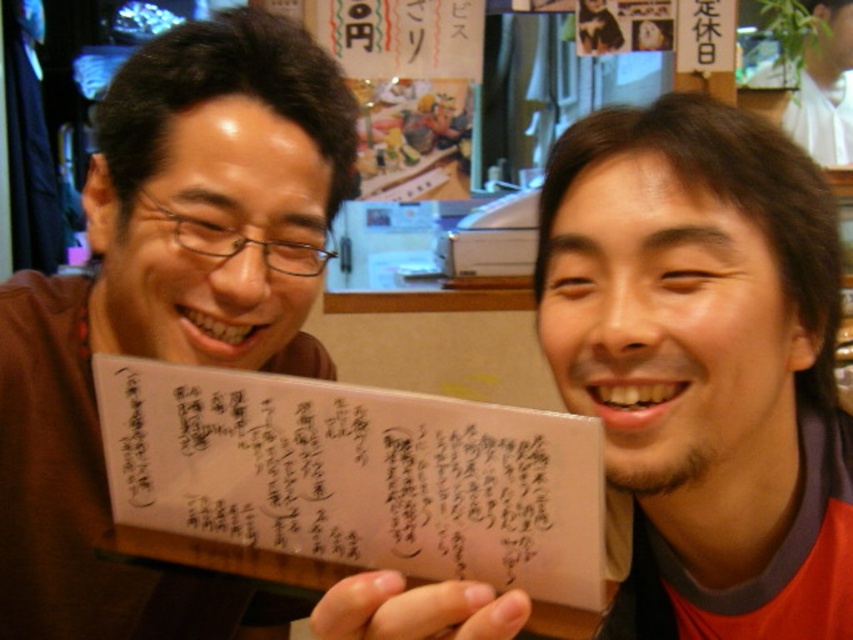
Question: Which of the following is the farthest from the observer?

Choices:
 (A) (136, 472)
 (B) (32, 502)
 (C) (808, 92)

Answer: (C)

Question: Which object is closer to the camera taking this photo?

Choices:
 (A) white paper at upper right
 (B) transparent paper at center
 (C) matte brown card at left

Answer: (B)

Question: Where is matte brown card at left located in relation to white paper at upper right in the image?

Choices:
 (A) left
 (B) right

Answer: (A)

Question: Which point appears farthest from the camera in this image?

Choices:
 (A) tap(288, 131)
 (B) tap(819, 1)

Answer: (B)

Question: Does matte brown card at left appear on the right side of transparent paper at center?

Choices:
 (A) no
 (B) yes

Answer: (A)

Question: Is matte brown card at left bigger than white paper at upper right?

Choices:
 (A) yes
 (B) no

Answer: (A)